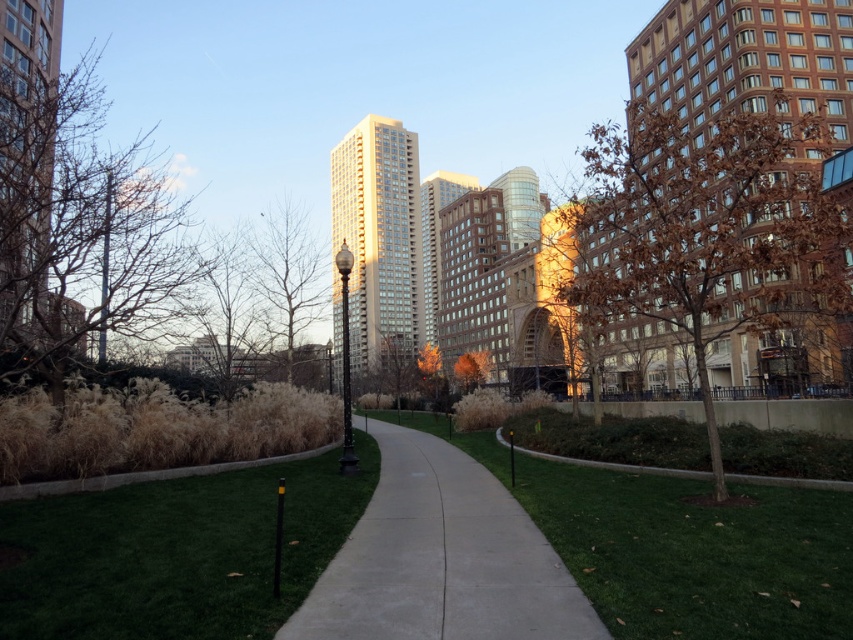
Does bare branches at center have a greater width compared to orange leafy tree at center?

Correct, the width of bare branches at center exceeds that of orange leafy tree at center.

Which is above, bare branches at center or orange leafy tree at center?

bare branches at center

Is point (289, 214) more distant than point (468, 385)?

No, (289, 214) is in front of (468, 385).

Identify the location of bare branches at center. The image size is (853, 640). (287, 273).

Is green grass at center above orange leafy tree at center?

Yes.

The height and width of the screenshot is (640, 853). I want to click on green grass at center, so click(177, 552).

Locate an element on the screen. This screenshot has width=853, height=640. green grass at center is located at coordinates (177, 552).

Which is behind, point (90, 548) or point (265, 224)?

The point (265, 224) is behind.

Does green grass at center appear under bare branches at center?

Yes, green grass at center is below bare branches at center.

Locate an element on the screen. Image resolution: width=853 pixels, height=640 pixels. green grass at center is located at coordinates (177, 552).